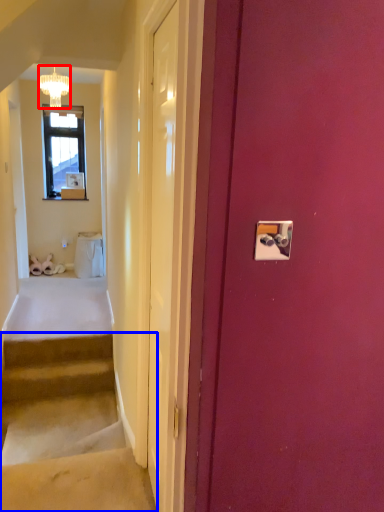
Question: Which object appears farthest to the camera in this image, lamp (highlighted by a red box) or stairs (highlighted by a blue box)?

Choices:
 (A) lamp
 (B) stairs

Answer: (A)